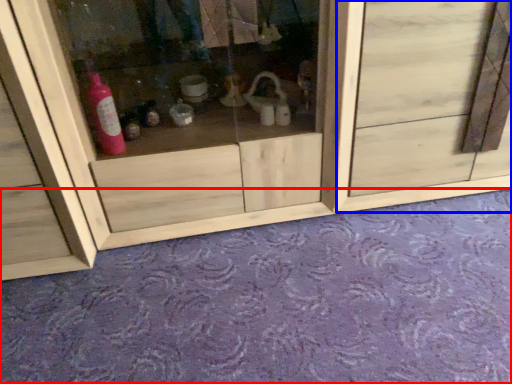
Question: Which object is further to the camera taking this photo, plain (highlighted by a red box) or door (highlighted by a blue box)?

Choices:
 (A) plain
 (B) door

Answer: (B)